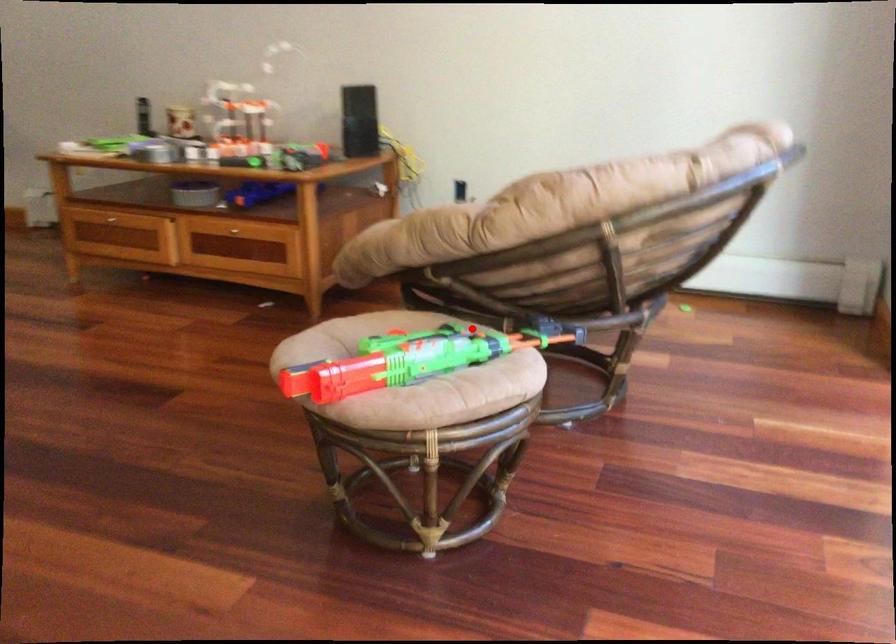
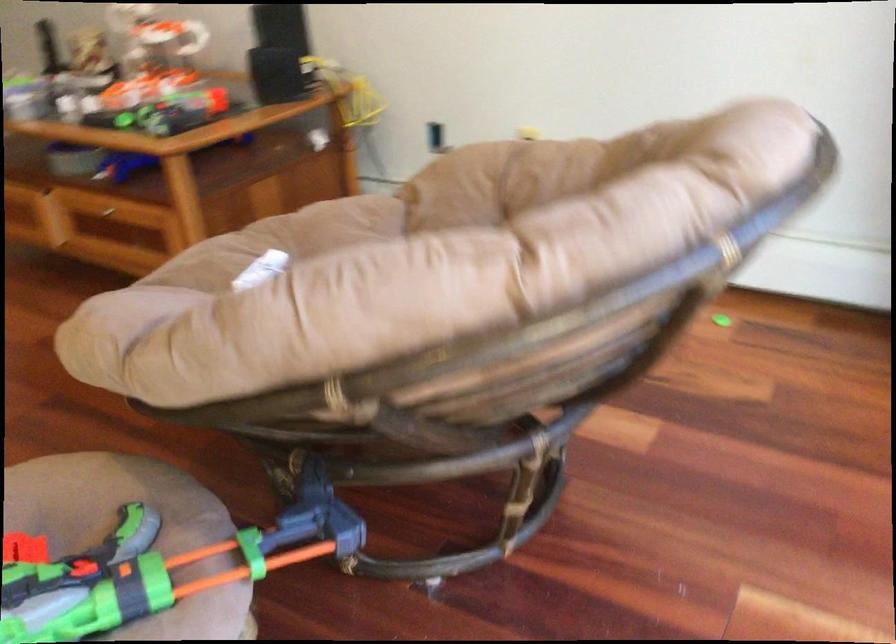
Locate, in the second image, the point that corresponds to the highlighted location in the first image.

(134, 527)